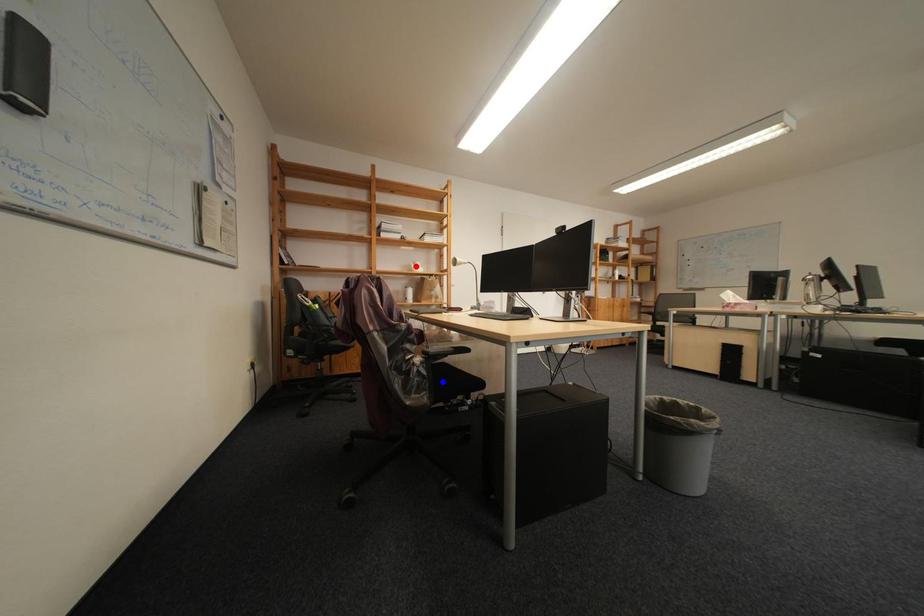
Question: In the image, two points are highlighted. Which point is nearer to the camera? Reply with the corresponding letter.

Choices:
 (A) blue point
 (B) red point

Answer: (A)